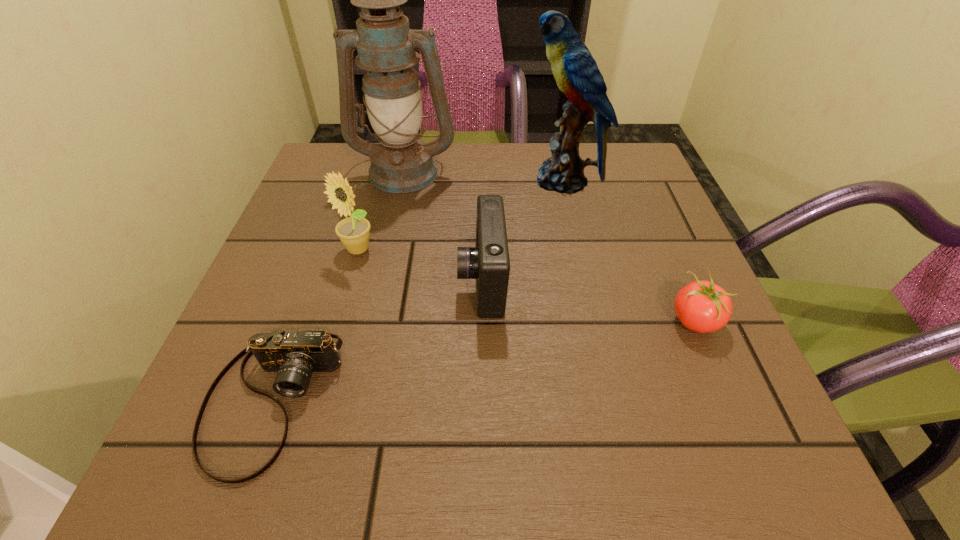
In the image, there is a desktop. Where is `free space at the left edge`? This screenshot has width=960, height=540. free space at the left edge is located at coordinates (291, 310).

The image size is (960, 540). What are the coordinates of `vacant region at the right edge` in the screenshot? It's located at (598, 214).

The height and width of the screenshot is (540, 960). Find the location of `free spot at the far left corner of the desktop`. free spot at the far left corner of the desktop is located at coordinates (334, 151).

In the image, there is a desktop. At what (x,y) coordinates should I click in order to perform the action: click on free space at the far right corner. Please return your answer as a coordinate pair (x, y). Image resolution: width=960 pixels, height=540 pixels. Looking at the image, I should click on (586, 146).

Find the location of a particular element. vacant area between the farther camera and the oil lamp is located at coordinates (444, 226).

Image resolution: width=960 pixels, height=540 pixels. I want to click on free area in between the fifth object from left to right and the tomato, so click(x=629, y=251).

I want to click on vacant point located between the tomato and the nearer camera, so click(x=484, y=361).

Locate an element on the screen. The height and width of the screenshot is (540, 960). free spot between the rightmost object and the oil lamp is located at coordinates (549, 246).

Where is `free space that is in between the tomato and the fourth object from left to right`? The height and width of the screenshot is (540, 960). free space that is in between the tomato and the fourth object from left to right is located at coordinates (588, 301).

Locate an element on the screen. Image resolution: width=960 pixels, height=540 pixels. vacant area between the oil lamp and the second object from right to left is located at coordinates (483, 176).